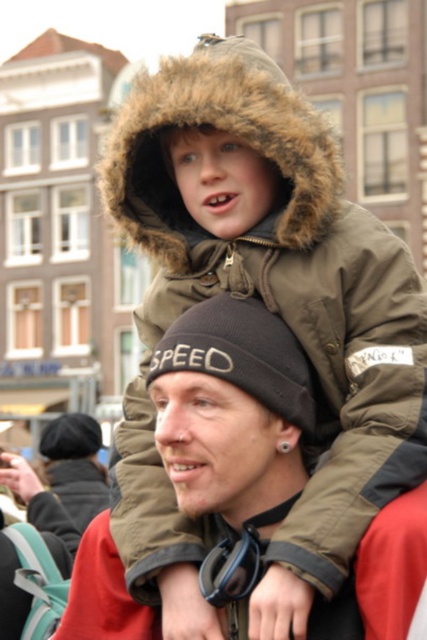
In the scene shown: Between olive-green fur-lined jacket at center and black knit beanie at center, which one has more height?

With more height is olive-green fur-lined jacket at center.

Can you confirm if olive-green fur-lined jacket at center is thinner than black knit beanie at center?

Incorrect, olive-green fur-lined jacket at center's width is not less than black knit beanie at center's.

Identify the location of olive-green fur-lined jacket at center. (266, 305).